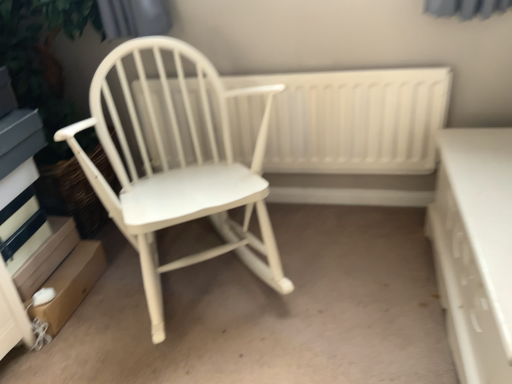
This screenshot has width=512, height=384. I want to click on unoccupied region to the right of white wood rocking chair at left, so click(x=350, y=262).